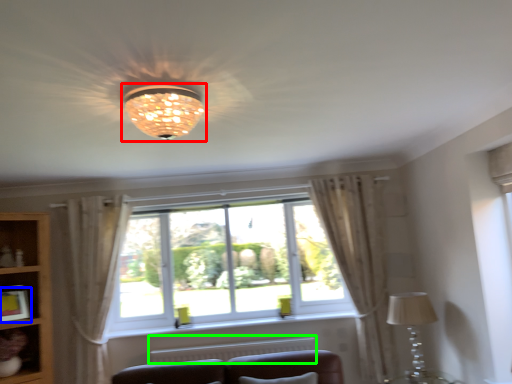
Question: Which object is the closest to the lamp (highlighted by a red box)? Choose among these: picture frame (highlighted by a blue box) or radiator (highlighted by a green box).

Choices:
 (A) picture frame
 (B) radiator

Answer: (B)